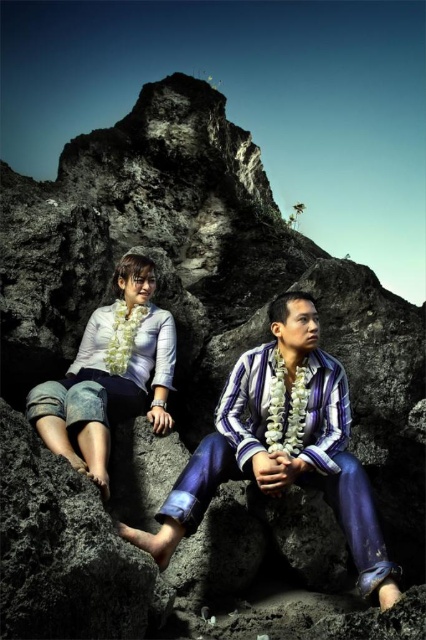
Who is taller, striped cotton shirt at center or smooth rock at lower center?

striped cotton shirt at center

Between striped cotton shirt at center and smooth rock at lower center, which one has less height?

smooth rock at lower center

Which is behind, point (391, 572) or point (141, 618)?

The point (391, 572) is more distant.

Find the location of a particular element. Image resolution: width=426 pixels, height=640 pixels. striped cotton shirt at center is located at coordinates [x=282, y=445].

Which of these two, smooth rock at lower center or denim shorts at left, stands shorter?

smooth rock at lower center is shorter.

From the picture: Who is taller, smooth rock at lower center or denim shorts at left?

denim shorts at left is taller.

Where is `smooth rock at lower center`? This screenshot has width=426, height=640. smooth rock at lower center is located at coordinates (65, 552).

Is point (195, 452) positioned before point (94, 449)?

No.

Who is more distant from viewer, (359, 566) or (115, 300)?

The point (115, 300) is behind.

You are a GUI agent. You are given a task and a screenshot of the screen. Output one action in this format:
    pyautogui.click(x=<x>, y=<y>)
    Task: Click on the striped cotton shirt at center
    This screenshot has height=640, width=426.
    Given the screenshot: What is the action you would take?
    pyautogui.click(x=282, y=445)

At what (x,y) coordinates should I click in order to perform the action: click on striped cotton shirt at center. Please return your answer as a coordinate pair (x, y). Looking at the image, I should click on (282, 445).